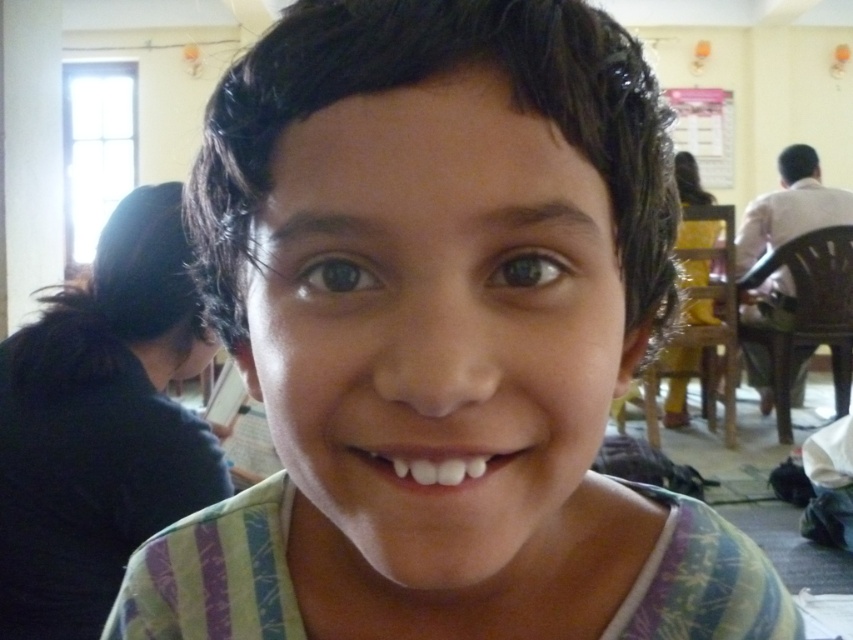
What is the color and type of the fabric located at the coordinates point (102,424) in the image?

The point (102,424) corresponds to dark blue fabric at left.

You are standing in the room shown in the image. There is a point marked at coordinates (790, 208). What object is located at this point?

The point at coordinates (790, 208) indicates the white shirt at right.